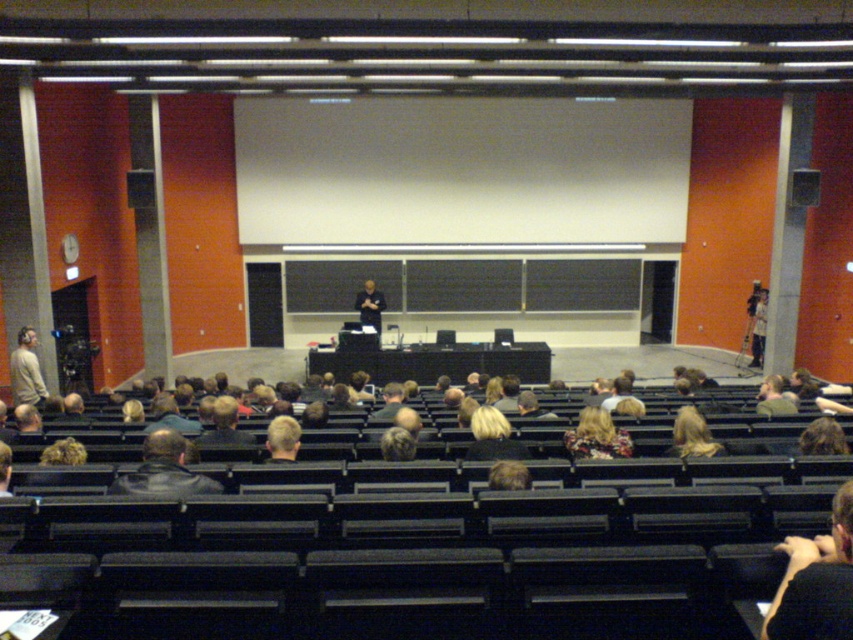
You are an attendee in the lecture hall and need to retrieve your dark brown leather jacket at lower right and the leather jacket at lower left. If you are currently standing at the center of the room, which jacket is closer to you?

The dark brown leather jacket at lower right is 2.48 meters away from the leather jacket at lower left. Since you are standing at the center of the room, the distance to each jacket depends on their positions relative to the center. However, without specific coordinates, it is impossible to determine which jacket is closer based solely on the given information.

You are an attendee in the lecture hall and notice two leather jackets on the floor near your seat. One is a dark brown leather jacket at lower right and the other is a leather jacket at lower left. Which jacket is closer to the stage?

The dark brown leather jacket at lower right is positioned on the right side of the leather jacket at lower left, so the dark brown leather jacket at lower right is closer to the stage if the stage is at the front and the jackets are placed to the right side of the room.